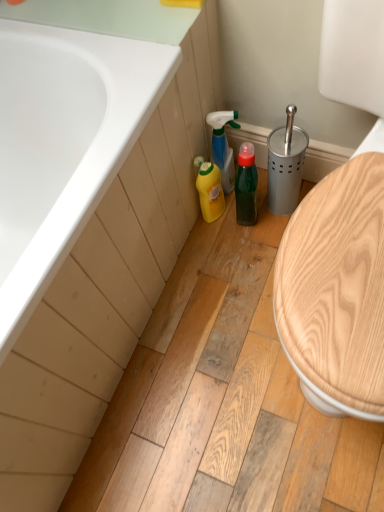
I want to click on green matte bottle at center, so click(246, 185).

Consider the image. How much space does translucent green spray bottle at center, the first cleaning product positioned from the top, occupy horizontally?

translucent green spray bottle at center, the first cleaning product positioned from the top, is 3.08 inches wide.

Where is `green matte bottle at center`? green matte bottle at center is located at coordinates (246, 185).

Is white glossy bathtub at upper left facing away from yellow plastic bottle at lower center, the 2th cleaning product when ordered from top to bottom?

No, yellow plastic bottle at lower center, the 2th cleaning product when ordered from top to bottom, is not at the back of white glossy bathtub at upper left.

From the picture: Which point is more forward, [78,202] or [218,199]?

The point [78,202] is more forward.

There is a white glossy bathtub at upper left. At what (x,y) coordinates should I click in order to perform the action: click on the 2nd cleaning product below it (from a real-world perspective). Please return your answer as a coordinate pair (x, y). Looking at the image, I should click on (210, 191).

Is there a large distance between white glossy bathtub at upper left and yellow plastic bottle at lower center, the 2th cleaning product when ordered from top to bottom?

No, white glossy bathtub at upper left is not far from yellow plastic bottle at lower center, the 2th cleaning product when ordered from top to bottom.

Measure the distance from green matte bottle at center to translucent green spray bottle at center, the 2th cleaning product in the bottom-to-top sequence.

They are 3.49 inches apart.

Considering the positions of objects green matte bottle at center and translucent green spray bottle at center, the 2th cleaning product in the bottom-to-top sequence, in the image provided, who is more to the right, green matte bottle at center or translucent green spray bottle at center, the 2th cleaning product in the bottom-to-top sequence,?

From the viewer's perspective, green matte bottle at center appears more on the right side.

Considering the sizes of objects green matte bottle at center and translucent green spray bottle at center, the 2th cleaning product in the bottom-to-top sequence, in the image provided, who is shorter, green matte bottle at center or translucent green spray bottle at center, the 2th cleaning product in the bottom-to-top sequence,?

With less height is green matte bottle at center.

Is green matte bottle at center looking in the opposite direction of translucent green spray bottle at center, the 2th cleaning product in the bottom-to-top sequence?

No, green matte bottle at center is not facing away from translucent green spray bottle at center, the 2th cleaning product in the bottom-to-top sequence.

Can you confirm if yellow plastic bottle at lower center, the 2th cleaning product when ordered from top to bottom, is wider than green matte bottle at center?

In fact, yellow plastic bottle at lower center, the 2th cleaning product when ordered from top to bottom, might be narrower than green matte bottle at center.

Considering the sizes of objects yellow plastic bottle at lower center, the 2th cleaning product when ordered from top to bottom, and green matte bottle at center in the image provided, who is shorter, yellow plastic bottle at lower center, the 2th cleaning product when ordered from top to bottom, or green matte bottle at center?

yellow plastic bottle at lower center, the 2th cleaning product when ordered from top to bottom, is shorter.

Between yellow plastic bottle at lower center, the 1th cleaning product from the bottom, and green matte bottle at center, which one has larger size?

green matte bottle at center.

Is yellow plastic bottle at lower center, the 1th cleaning product from the bottom, spatially inside green matte bottle at center, or outside of it?

yellow plastic bottle at lower center, the 1th cleaning product from the bottom, lies outside green matte bottle at center.

Is translucent green spray bottle at center, the first cleaning product positioned from the top, looking in the opposite direction of green matte bottle at center?

No.

Looking at the image, does translucent green spray bottle at center, the 2th cleaning product in the bottom-to-top sequence, seem bigger or smaller compared to green matte bottle at center?

translucent green spray bottle at center, the 2th cleaning product in the bottom-to-top sequence, is bigger than green matte bottle at center.

Between translucent green spray bottle at center, the 2th cleaning product in the bottom-to-top sequence, and green matte bottle at center, which one is positioned in front?

green matte bottle at center is closer to the camera.

From the picture: Which object is thinner, translucent green spray bottle at center, the first cleaning product positioned from the top, or green matte bottle at center?

Thinner between the two is translucent green spray bottle at center, the first cleaning product positioned from the top.

Is translucent green spray bottle at center, the first cleaning product positioned from the top, not inside white glossy bathtub at upper left?

Yes, translucent green spray bottle at center, the first cleaning product positioned from the top, is located beyond the bounds of white glossy bathtub at upper left.

Is point (235, 128) closer or farther from the camera than point (19, 170)?

Clearly, point (235, 128) is more distant from the camera than point (19, 170).

Which object is wider, translucent green spray bottle at center, the 2th cleaning product in the bottom-to-top sequence, or white glossy bathtub at upper left?

Wider between the two is white glossy bathtub at upper left.

From the image's perspective, which object appears higher, translucent green spray bottle at center, the first cleaning product positioned from the top, or white glossy bathtub at upper left?

translucent green spray bottle at center, the first cleaning product positioned from the top, from the image's perspective.

Can you confirm if white glossy bathtub at upper left is smaller than translucent green spray bottle at center, the first cleaning product positioned from the top?

No.

This screenshot has width=384, height=512. In order to click on bathtub above the translucent green spray bottle at center, the first cleaning product positioned from the top (from a real-world perspective) in this screenshot , I will do `click(64, 145)`.

Is white glossy bathtub at upper left at the left side of translucent green spray bottle at center, the first cleaning product positioned from the top?

Yes, white glossy bathtub at upper left is to the left of translucent green spray bottle at center, the first cleaning product positioned from the top.

Who is more distant, green matte bottle at center or white glossy bathtub at upper left?

green matte bottle at center is further from the camera.

From the image's perspective, relative to white glossy bathtub at upper left, is green matte bottle at center above or below?

Based on their image positions, green matte bottle at center is located above white glossy bathtub at upper left.

Considering the sizes of green matte bottle at center and white glossy bathtub at upper left in the image, is green matte bottle at center bigger or smaller than white glossy bathtub at upper left?

Clearly, green matte bottle at center is smaller in size than white glossy bathtub at upper left.

Which object is positioned more to the left, green matte bottle at center or white glossy bathtub at upper left?

white glossy bathtub at upper left is more to the left.

From a real-world perspective, which cleaning product is the 2nd one underneath the white glossy bathtub at upper left? Please provide its 2D coordinates.

[(210, 191)]

I want to click on cleaning product lying above the green matte bottle at center (from the image's perspective), so click(223, 146).

Looking at the image, which one is located further to green matte bottle at center, yellow plastic bottle at lower center, the 1th cleaning product from the bottom, or translucent green spray bottle at center, the first cleaning product positioned from the top?

Based on the image, translucent green spray bottle at center, the first cleaning product positioned from the top, appears to be further to green matte bottle at center.

Considering their positions, is white glossy bathtub at upper left positioned further to green matte bottle at center than yellow plastic bottle at lower center, the 1th cleaning product from the bottom?

Among the two, white glossy bathtub at upper left is located further to green matte bottle at center.

Which object lies nearer to the anchor point yellow plastic bottle at lower center, the 1th cleaning product from the bottom, green matte bottle at center or translucent green spray bottle at center, the 2th cleaning product in the bottom-to-top sequence?

Based on the image, translucent green spray bottle at center, the 2th cleaning product in the bottom-to-top sequence, appears to be nearer to yellow plastic bottle at lower center, the 1th cleaning product from the bottom.

Consider the image. From the image, which object appears to be nearer to translucent green spray bottle at center, the 2th cleaning product in the bottom-to-top sequence, white glossy bathtub at upper left or yellow plastic bottle at lower center, the 1th cleaning product from the bottom?

yellow plastic bottle at lower center, the 1th cleaning product from the bottom, is closer to translucent green spray bottle at center, the 2th cleaning product in the bottom-to-top sequence.

Which object lies further to the anchor point translucent green spray bottle at center, the first cleaning product positioned from the top, green matte bottle at center or yellow plastic bottle at lower center, the 1th cleaning product from the bottom?

green matte bottle at center.

Estimate the real-world distances between objects in this image. Which object is closer to green matte bottle at center, translucent green spray bottle at center, the first cleaning product positioned from the top, or white glossy bathtub at upper left?

The object closer to green matte bottle at center is translucent green spray bottle at center, the first cleaning product positioned from the top.

From the image, which object appears to be farther from green matte bottle at center, translucent green spray bottle at center, the 2th cleaning product in the bottom-to-top sequence, or yellow plastic bottle at lower center, the 1th cleaning product from the bottom?

translucent green spray bottle at center, the 2th cleaning product in the bottom-to-top sequence, is positioned further to the anchor green matte bottle at center.

Looking at the image, which one is located further to yellow plastic bottle at lower center, the 2th cleaning product when ordered from top to bottom, white glossy bathtub at upper left or green matte bottle at center?

white glossy bathtub at upper left is positioned further to the anchor yellow plastic bottle at lower center, the 2th cleaning product when ordered from top to bottom.

At what (x,y) coordinates should I click in order to perform the action: click on bottle located between white glossy bathtub at upper left and yellow plastic bottle at lower center, the 1th cleaning product from the bottom, in the depth direction. Please return your answer as a coordinate pair (x, y). Looking at the image, I should click on (246, 185).

You are a GUI agent. You are given a task and a screenshot of the screen. Output one action in this format:
    pyautogui.click(x=<x>, y=<y>)
    Task: Click on the cleaning product between white glossy bathtub at upper left and yellow plastic bottle at lower center, the 1th cleaning product from the bottom, along the z-axis
    This screenshot has height=512, width=384.
    Given the screenshot: What is the action you would take?
    pyautogui.click(x=223, y=146)

The image size is (384, 512). Identify the location of bottle that lies between translucent green spray bottle at center, the 2th cleaning product in the bottom-to-top sequence, and yellow plastic bottle at lower center, the 1th cleaning product from the bottom, from top to bottom. (246, 185).